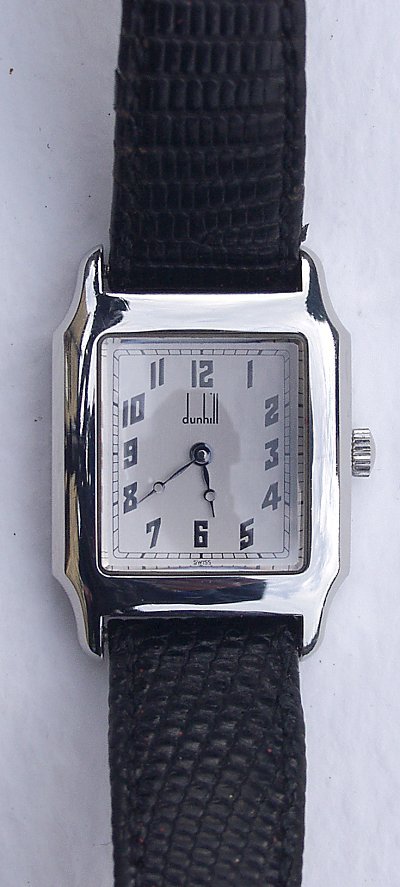
The image size is (400, 887). I want to click on mini digital clock, so click(x=213, y=460).